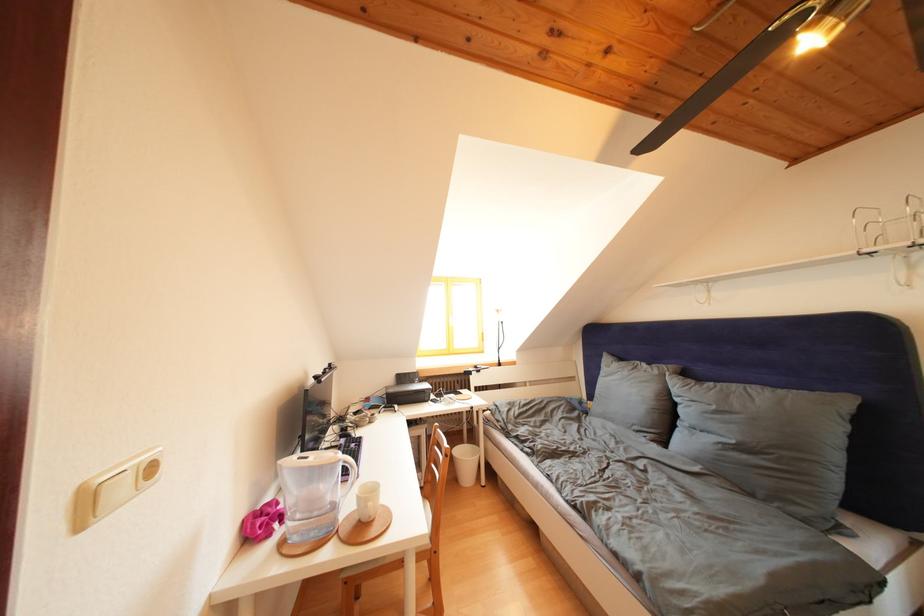
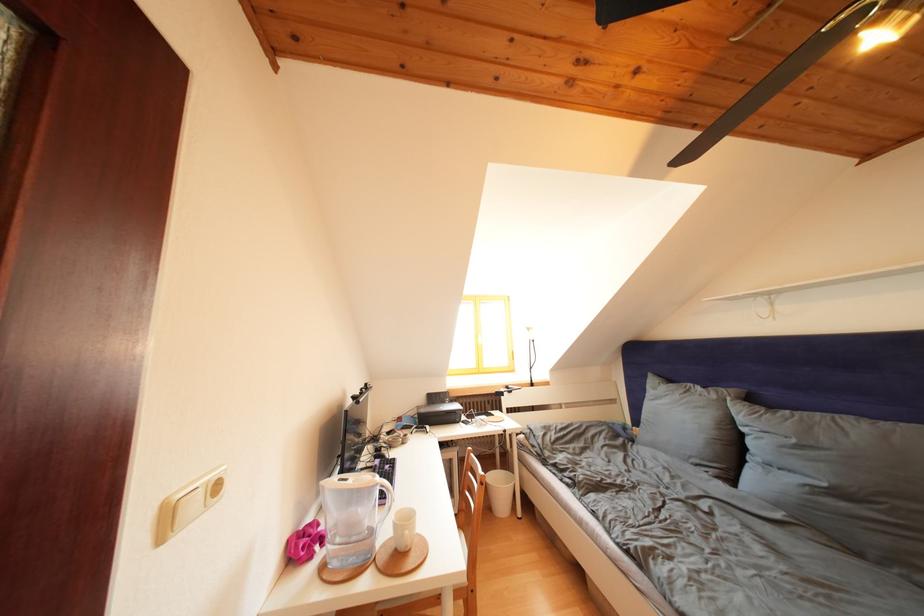
Find the pixel in the second image that matches pixel 663 377 in the first image.

(722, 402)